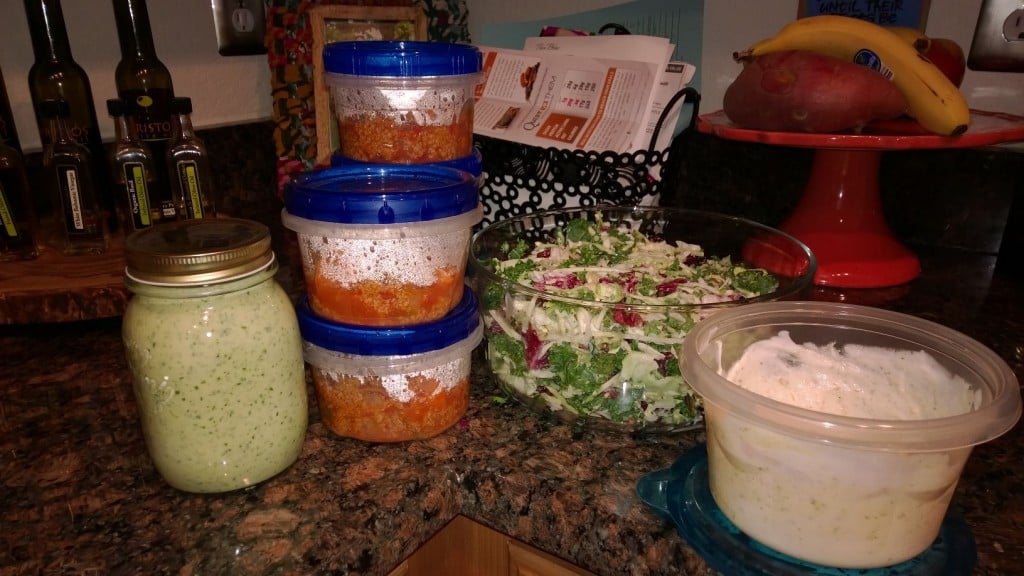
In order to click on glass bowl in this screenshot , I will do coord(588,355).